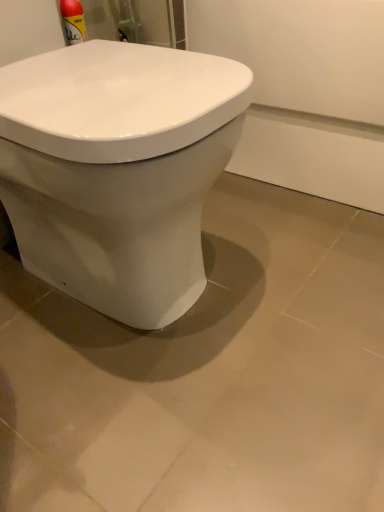
At what (x,y) coordinates should I click in order to perform the action: click on vacant space in front of white glossy toilet at center. Please return your answer as a coordinate pair (x, y). The height and width of the screenshot is (512, 384). Looking at the image, I should click on (114, 404).